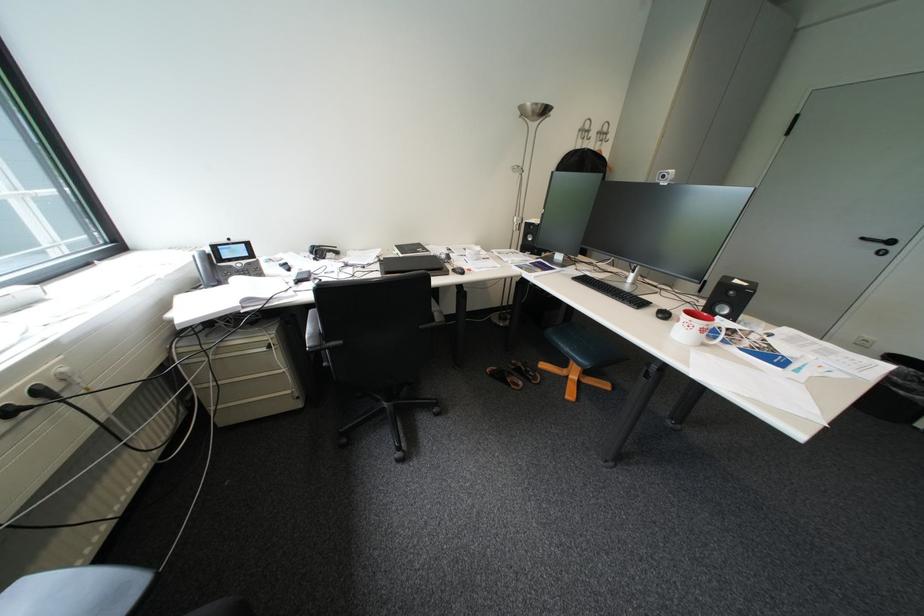
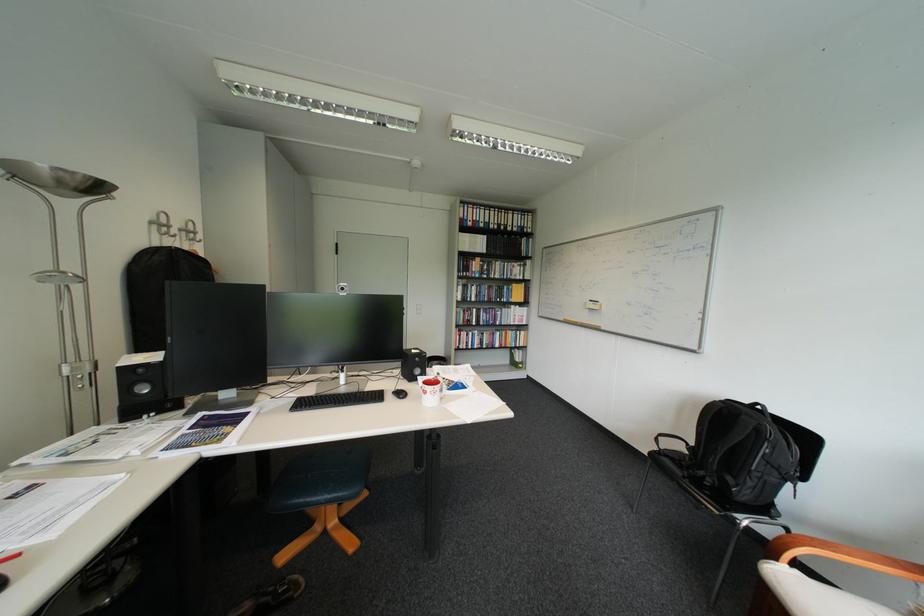
Question: The camera is either moving clockwise (left) or counter-clockwise (right) around the object. The first image is from the beginning of the video and the second image is from the end. Is the camera moving left or right when shooting the video?

Choices:
 (A) Left
 (B) Right

Answer: (A)